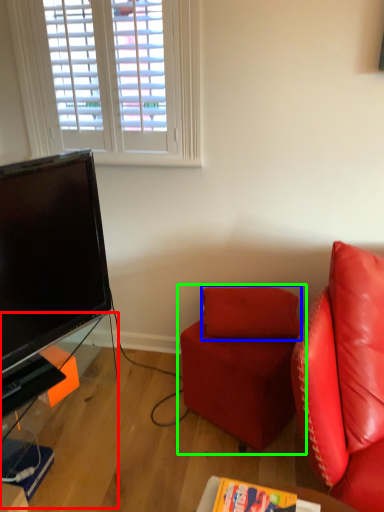
Question: Considering the real-world distances, which object is closest to table (highlighted by a red box)? pillow (highlighted by a blue box) or studio couch (highlighted by a green box).

Choices:
 (A) pillow
 (B) studio couch

Answer: (B)